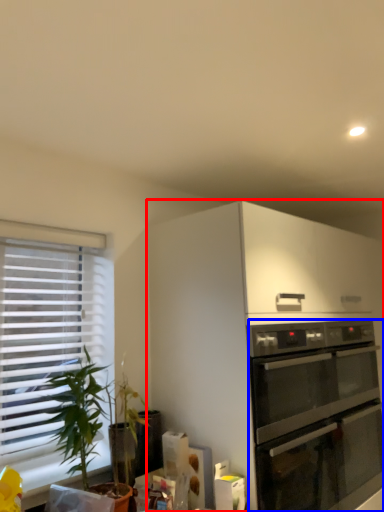
Question: Among these objects, which one is farthest to the camera, cabinetry (highlighted by a red box) or oven (highlighted by a blue box)?

Choices:
 (A) cabinetry
 (B) oven

Answer: (B)